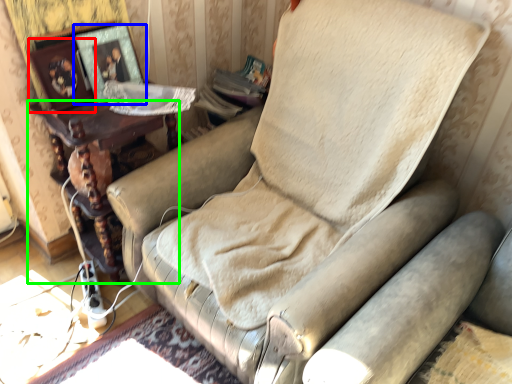
Question: Which object is the farthest from picture frame (highlighted by a red box)? Choose among these: picture frame (highlighted by a blue box) or furniture (highlighted by a green box).

Choices:
 (A) picture frame
 (B) furniture

Answer: (B)